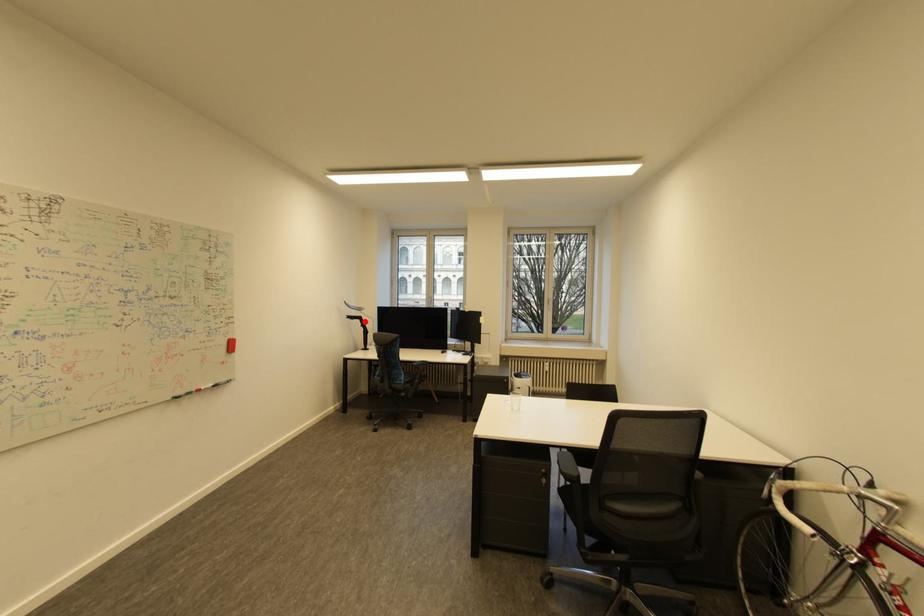
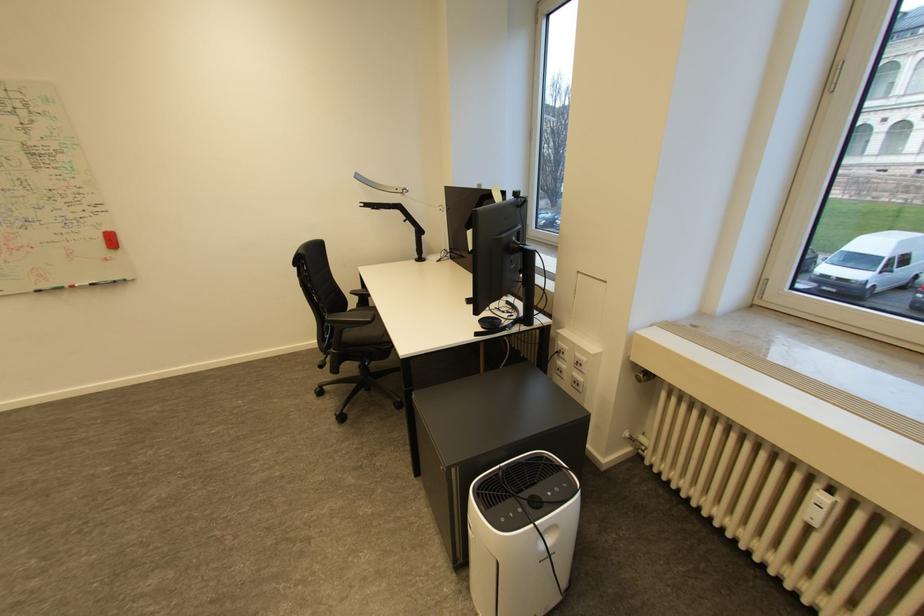
The point at the highlighted location is marked in the first image. Where is the corresponding point in the second image?

(405, 213)